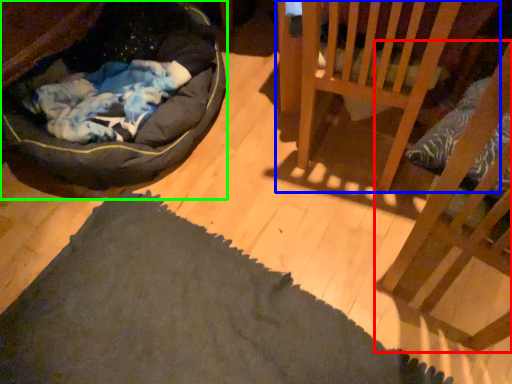
Question: Estimate the real-world distances between objects in this image. Which object is farther from furniture (highlighted by a red box), furniture (highlighted by a blue box) or dog bed (highlighted by a green box)?

Choices:
 (A) furniture
 (B) dog bed

Answer: (B)